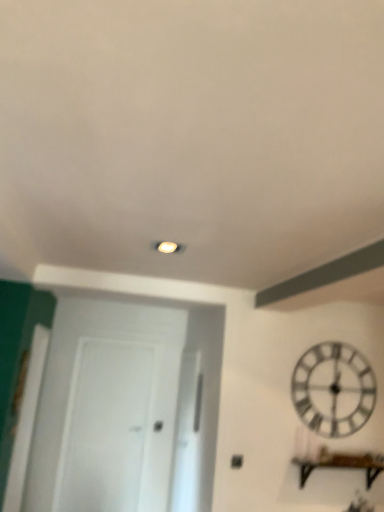
Question: Visually, is brown wooden shelf at lower right positioned to the left or to the right of white wooden clock at upper right?

Choices:
 (A) right
 (B) left

Answer: (A)

Question: Is brown wooden shelf at lower right bigger or smaller than white wooden clock at upper right?

Choices:
 (A) small
 (B) big

Answer: (B)

Question: Based on their relative distances, which object is nearer to the white wooden clock at upper right?

Choices:
 (A) transparent glass door at center, which is the 1th glass door in right-to-left order
 (B) transparent glass door at center, arranged as the 2th glass door when viewed from the right
 (C) brown wooden shelf at lower right

Answer: (C)

Question: Based on their relative distances, which object is farther from the transparent glass door at center, which is the 1th glass door in right-to-left order?

Choices:
 (A) transparent glass door at center, the first glass door from the left
 (B) white wooden clock at upper right
 (C) brown wooden shelf at lower right

Answer: (C)